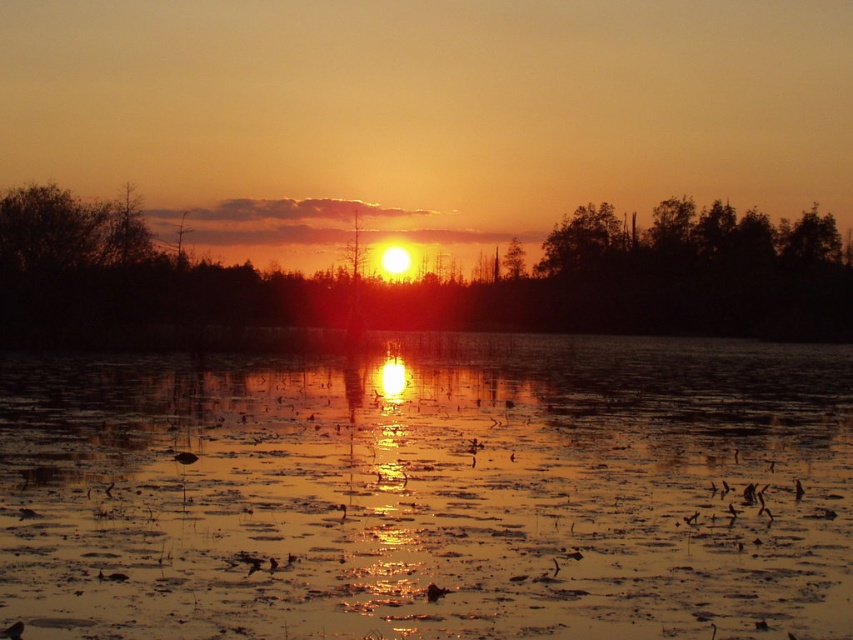
Question: In this image, where is golden reflective water at center located relative to silhouette tree at center?

Choices:
 (A) right
 (B) left

Answer: (A)

Question: Estimate the real-world distances between objects in this image. Which object is farther from the silhouette tree at center?

Choices:
 (A) green matte tree at upper right
 (B) golden reflective water at center

Answer: (B)

Question: Can you confirm if silhouette tree at center is smaller than green matte tree at upper right?

Choices:
 (A) yes
 (B) no

Answer: (B)

Question: Based on their relative distances, which object is nearer to the green matte tree at upper right?

Choices:
 (A) golden reflective water at center
 (B) silhouette tree at center

Answer: (B)

Question: Which of the following is the farthest from the observer?

Choices:
 (A) coord(640,452)
 (B) coord(583,244)
 (C) coord(469,326)

Answer: (B)

Question: Where is silhouette tree at center located in relation to green matte tree at upper right in the image?

Choices:
 (A) left
 (B) right

Answer: (A)